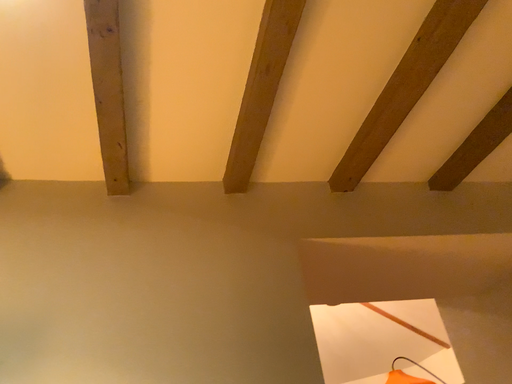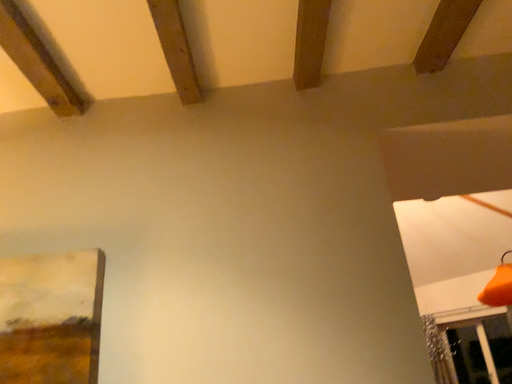
Question: Which way did the camera rotate in the video?

Choices:
 (A) rotated left
 (B) rotated right

Answer: (A)